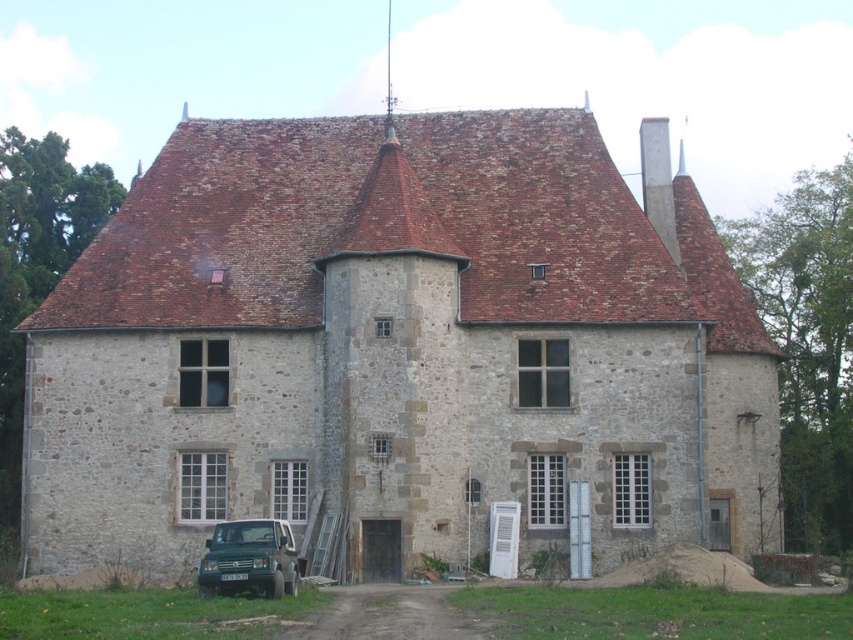
You are standing at the entrance of the traditional stone building and want to park your car in the closest available spot. The parking spots are marked at coordinates ranging from 0.0 to 1.0 on both axes. Where should you drive to park closest to the green matte suv at lower center?

The green matte suv at lower center is located at coordinates (x=248, y=560). To park closest to it, you should drive to the parking spot nearest to those coordinates.

You are a delivery driver approaching the historic stone building. You need to park your green matte suv at lower center in a spot that won t block the view of the white concrete chimney at upper center. Can you park the suv in its current position?

The green matte suv at lower center is currently positioned below the white concrete chimney at upper center. Since the suv is already located beneath the chimney, parking it there would block the view of the chimney. Therefore, you should choose a different parking spot that allows the chimney to remain visible.

You are a delivery driver approaching the historic manor. You need to park your green matte suv at lower center near the white concrete chimney at upper center. Based on the scene, can you determine which side of the chimney you should park the SUV?

The green matte suv at lower center should be parked on the left side of the white concrete chimney at upper center as it is positioned on the left side of the chimney.